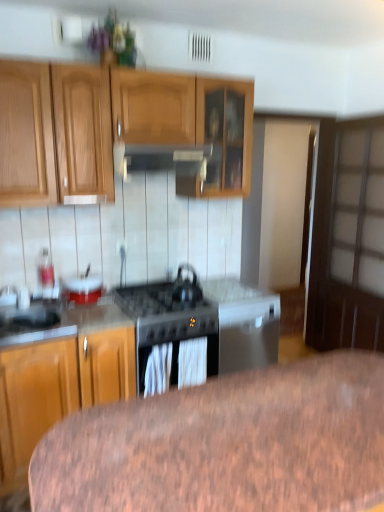
Question: Should I look upward or downward to see black matte gas stove at center?

Choices:
 (A) down
 (B) up

Answer: (A)

Question: From the image's perspective, is white glossy bowl at center-left below black matte gas stove at center?

Choices:
 (A) no
 (B) yes

Answer: (A)

Question: Considering the relative positions of white glossy bowl at center-left and black matte gas stove at center in the image provided, is white glossy bowl at center-left to the right of black matte gas stove at center from the viewer's perspective?

Choices:
 (A) yes
 (B) no

Answer: (B)

Question: From the image's perspective, is white glossy bowl at center-left located above black matte gas stove at center?

Choices:
 (A) no
 (B) yes

Answer: (B)

Question: Could you tell me if white glossy bowl at center-left is turned towards black matte gas stove at center?

Choices:
 (A) no
 (B) yes

Answer: (A)

Question: Can you confirm if white glossy bowl at center-left is wider than black matte gas stove at center?

Choices:
 (A) yes
 (B) no

Answer: (B)

Question: From a real-world perspective, is white glossy bowl at center-left below black matte gas stove at center?

Choices:
 (A) yes
 (B) no

Answer: (B)

Question: Can you confirm if brown wood table at lower center is taller than satin silver sink at lower left?

Choices:
 (A) yes
 (B) no

Answer: (A)

Question: From a real-world perspective, is brown wood table at lower center under satin silver sink at lower left?

Choices:
 (A) yes
 (B) no

Answer: (A)

Question: Is brown wood table at lower center in contact with satin silver sink at lower left?

Choices:
 (A) yes
 (B) no

Answer: (B)

Question: Is the depth of brown wood table at lower center greater than that of satin silver sink at lower left?

Choices:
 (A) no
 (B) yes

Answer: (A)

Question: Considering the relative sizes of brown wood table at lower center and satin silver sink at lower left in the image provided, is brown wood table at lower center thinner than satin silver sink at lower left?

Choices:
 (A) no
 (B) yes

Answer: (A)

Question: Is brown wood table at lower center positioned far away from satin silver sink at lower left?

Choices:
 (A) no
 (B) yes

Answer: (B)

Question: Considering the relative sizes of satin silver exhaust hood at upper center and white glossy bowl at center-left in the image provided, is satin silver exhaust hood at upper center thinner than white glossy bowl at center-left?

Choices:
 (A) yes
 (B) no

Answer: (B)